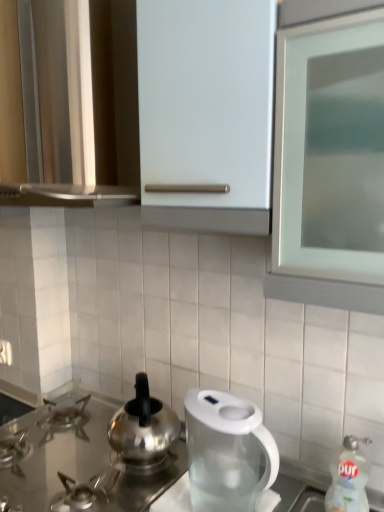
Question: In terms of height, does polished stainless steel kettle at center look taller or shorter compared to transparent plastic kettle at center?

Choices:
 (A) tall
 (B) short

Answer: (B)

Question: Considering the positions of polished stainless steel kettle at center and transparent plastic kettle at center in the image, is polished stainless steel kettle at center bigger or smaller than transparent plastic kettle at center?

Choices:
 (A) big
 (B) small

Answer: (B)

Question: Based on their relative distances, which object is farther from the polished stainless steel kettle at center?

Choices:
 (A) white glossy bottle at lower right
 (B) matte white cabinet at upper center
 (C) satin silver gas stove at lower left
 (D) transparent plastic kettle at center

Answer: (B)

Question: Which object is positioned closest to the polished stainless steel kettle at center?

Choices:
 (A) white glossy bottle at lower right
 (B) satin silver gas stove at lower left
 (C) matte white cabinet at upper center
 (D) transparent plastic kettle at center

Answer: (D)